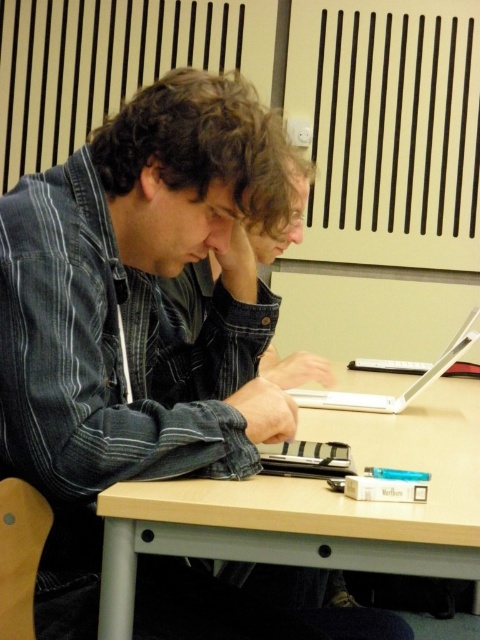
You are sitting at the table and want to place a small object between the two points labeled as point (x=376, y=522) and point (x=347, y=406). Based on their positions, which point is closer to you?

Point (x=376, y=522) is in front of point (x=347, y=406), so it is closer to you.

You are standing at the camera position and want to place a small object exactly 1 meter away from you. Is the point at coordinates point (179, 547) suitable for placing the object?

The distance between point (179, 547) and the camera is 75.55 centimeters, which is less than 1 meter. Therefore, placing the object at point (179, 547) would not be suitable as it is closer than the desired distance.

You are trying to place a new laptop stand that requires 10 inches of space between the table and the laptop. Can the light brown wood table at center accommodate the white plastic laptop at center with this stand?

The light brown wood table at center is only 9.48 inches from the white plastic laptop at center, which is less than the required 10 inches. Therefore, the table cannot accommodate the laptop stand with the required space.